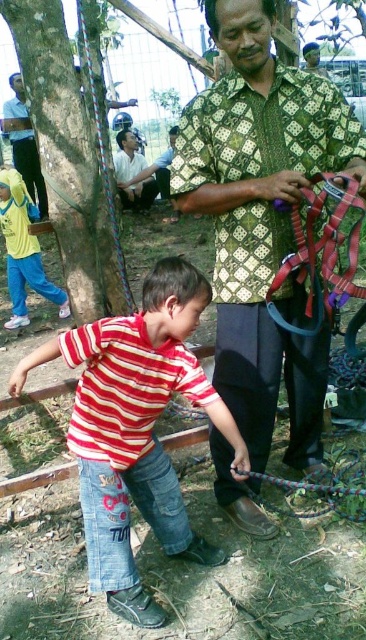
Can you confirm if green patterned shirt at center is positioned below light brown fabric shirt at upper center?

Yes, green patterned shirt at center is below light brown fabric shirt at upper center.

Which is in front, point (327, 148) or point (121, 193)?

Point (327, 148) is in front.

Identify the location of green patterned shirt at center. This screenshot has width=366, height=640. (262, 218).

Between striped cotton shirt at center and yellow fabric shirt at left, which one has more height?

yellow fabric shirt at left

Who is lower down, striped cotton shirt at center or yellow fabric shirt at left?

striped cotton shirt at center is below.

What do you see at coordinates (136, 429) in the screenshot?
I see `striped cotton shirt at center` at bounding box center [136, 429].

Where is `striped cotton shirt at center`? The height and width of the screenshot is (640, 366). striped cotton shirt at center is located at coordinates (136, 429).

Does point (30, 156) come closer to viewer compared to point (137, 163)?

That is True.

Between brushed metal helmet at upper left and light brown fabric shirt at upper center, which one has more height?

With more height is light brown fabric shirt at upper center.

Identify the location of brushed metal helmet at upper left. (24, 144).